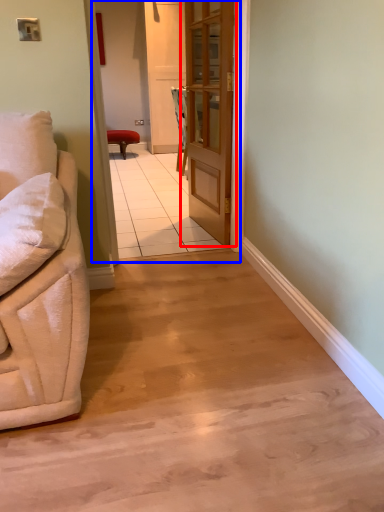
Question: Which object appears farthest to the camera in this image, door (highlighted by a red box) or corridor (highlighted by a blue box)?

Choices:
 (A) door
 (B) corridor

Answer: (A)